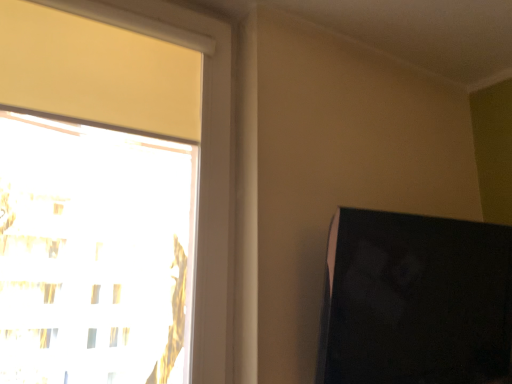
Locate an element on the screen. The height and width of the screenshot is (384, 512). matte black monitor at right is located at coordinates (415, 300).

The width and height of the screenshot is (512, 384). What do you see at coordinates (415, 300) in the screenshot? I see `matte black monitor at right` at bounding box center [415, 300].

In order to click on transparent glass window at upper left in this screenshot , I will do `click(140, 111)`.

Describe the element at coordinates (140, 111) in the screenshot. I see `transparent glass window at upper left` at that location.

At what (x,y) coordinates should I click in order to perform the action: click on matte black monitor at right. Please return your answer as a coordinate pair (x, y). Looking at the image, I should click on (415, 300).

Can you confirm if matte black monitor at right is positioned to the right of transparent glass window at upper left?

Yes, matte black monitor at right is to the right of transparent glass window at upper left.

Which is behind, matte black monitor at right or transparent glass window at upper left?

matte black monitor at right is behind.

Which is behind, point (458, 348) or point (228, 92)?

Point (458, 348)

From the image's perspective, is matte black monitor at right above transparent glass window at upper left?

No.

From a real-world perspective, is matte black monitor at right physically below transparent glass window at upper left?

Yes.

Consider the image. In terms of width, does matte black monitor at right look wider or thinner when compared to transparent glass window at upper left?

Considering their sizes, matte black monitor at right looks broader than transparent glass window at upper left.

Is matte black monitor at right taller or shorter than transparent glass window at upper left?

matte black monitor at right is shorter than transparent glass window at upper left.

Can you confirm if matte black monitor at right is smaller than transparent glass window at upper left?

No, matte black monitor at right is not smaller than transparent glass window at upper left.

Is matte black monitor at right inside or outside of transparent glass window at upper left?

matte black monitor at right lies outside transparent glass window at upper left.

Is matte black monitor at right touching transparent glass window at upper left?

There is a gap between matte black monitor at right and transparent glass window at upper left.

Does matte black monitor at right turn towards transparent glass window at upper left?

No, matte black monitor at right is not oriented towards transparent glass window at upper left.

Can you tell me how much matte black monitor at right and transparent glass window at upper left differ in facing direction?

The angle between the facing direction of matte black monitor at right and the facing direction of transparent glass window at upper left is 1.3 degrees.

The image size is (512, 384). In order to click on window above the matte black monitor at right (from a real-world perspective) in this screenshot , I will do `click(140, 111)`.

Is transparent glass window at upper left to the left or to the right of matte black monitor at right in the image?

From the image, it's evident that transparent glass window at upper left is to the left of matte black monitor at right.

In the image, is transparent glass window at upper left positioned in front of or behind matte black monitor at right?

transparent glass window at upper left is in front of matte black monitor at right.

Between point (103, 16) and point (398, 308), which one is positioned in front?

Positioned in front is point (103, 16).

From the image's perspective, which object appears higher, transparent glass window at upper left or matte black monitor at right?

transparent glass window at upper left appears higher in the image.

From a real-world perspective, is transparent glass window at upper left under matte black monitor at right?

No.

Considering the relative sizes of transparent glass window at upper left and matte black monitor at right in the image provided, is transparent glass window at upper left thinner than matte black monitor at right?

Yes.

Does transparent glass window at upper left have a greater height compared to matte black monitor at right?

Correct, transparent glass window at upper left is much taller as matte black monitor at right.

Can you confirm if transparent glass window at upper left is smaller than matte black monitor at right?

Yes, transparent glass window at upper left is smaller than matte black monitor at right.

Would you say matte black monitor at right is part of transparent glass window at upper left's contents?

Actually, matte black monitor at right is outside transparent glass window at upper left.

Are transparent glass window at upper left and matte black monitor at right far apart?

That's not correct — transparent glass window at upper left is a little close to matte black monitor at right.

Does transparent glass window at upper left turn towards matte black monitor at right?

No, transparent glass window at upper left is not aimed at matte black monitor at right.

You are a GUI agent. You are given a task and a screenshot of the screen. Output one action in this format:
    pyautogui.click(x=<x>, y=<y>)
    Task: Click on the window on the left of matte black monitor at right
    The image size is (512, 384).
    Given the screenshot: What is the action you would take?
    pyautogui.click(x=140, y=111)

Where is `computer monitor that is on the right side of transparent glass window at upper left`? The image size is (512, 384). computer monitor that is on the right side of transparent glass window at upper left is located at coordinates (415, 300).

This screenshot has height=384, width=512. I want to click on window on the left side of matte black monitor at right, so click(140, 111).